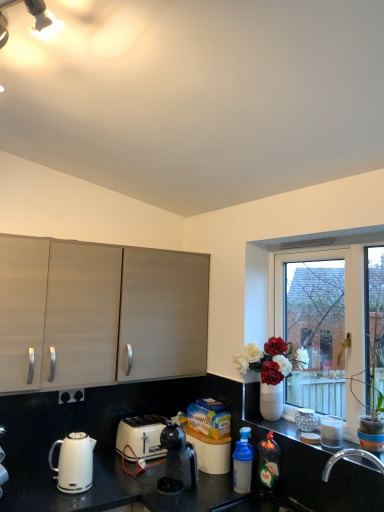
Find the location of a particular element. The width and height of the screenshot is (384, 512). free space above white plastic toaster at lower center (from a real-world perspective) is located at coordinates (137, 417).